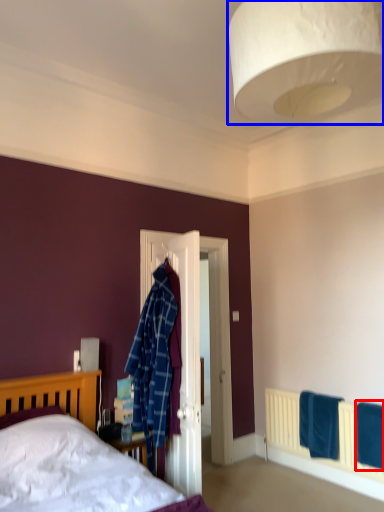
Question: Which object appears closest to the camera in this image, bath towel (highlighted by a red box) or lamp (highlighted by a blue box)?

Choices:
 (A) bath towel
 (B) lamp

Answer: (B)